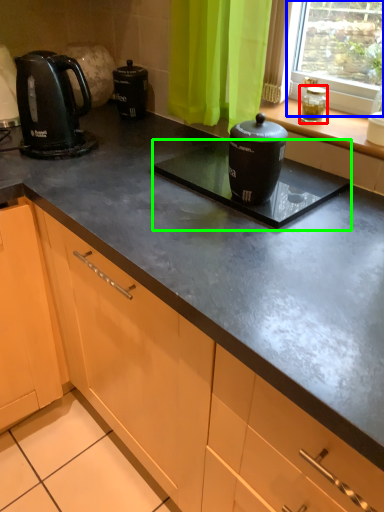
Question: Based on their relative distances, which object is nearer to appliance (highlighted by a red box)? Choose from window (highlighted by a blue box) and appliance (highlighted by a green box).

Choices:
 (A) window
 (B) appliance

Answer: (A)